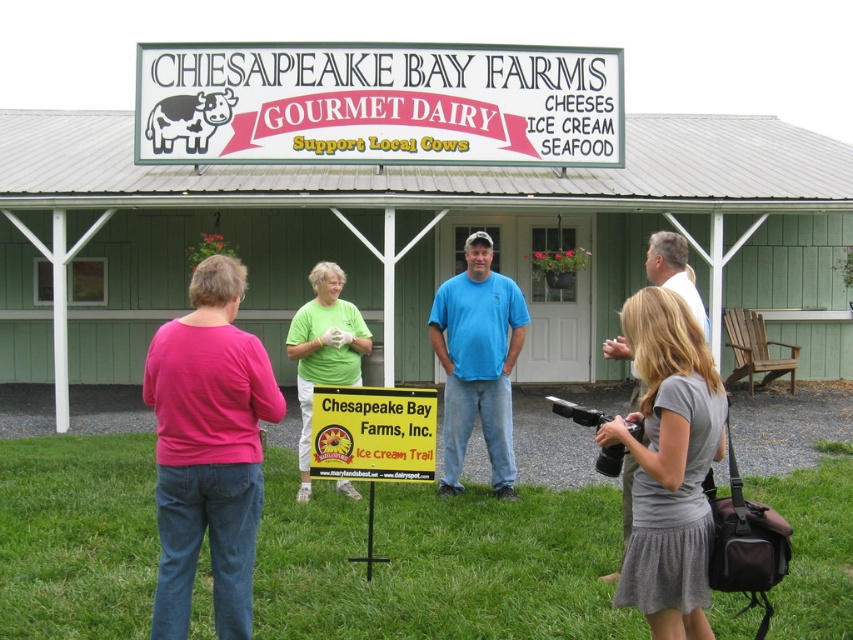
Question: Does pink fabric shirt at center have a larger size compared to blue cotton shirt at center?

Choices:
 (A) no
 (B) yes

Answer: (A)

Question: Among these points, which one is farthest from the camera?

Choices:
 (A) (670, 257)
 (B) (431, 428)
 (C) (630, 428)
 (D) (314, 356)

Answer: (D)

Question: Based on their relative distances, which object is farther from the blue cotton shirt at center?

Choices:
 (A) yellow paper sign at center
 (B) white cotton shirt at center
 (C) black plastic video camera at lower right

Answer: (C)

Question: Is white wooden sign at upper center bigger than pink fabric shirt at center?

Choices:
 (A) yes
 (B) no

Answer: (A)

Question: Is the position of white wooden sign at upper center more distant than that of yellow paper sign at center?

Choices:
 (A) no
 (B) yes

Answer: (B)

Question: Which of the following is the farthest from the observer?

Choices:
 (A) white wooden sign at upper center
 (B) pink fabric shirt at center

Answer: (A)